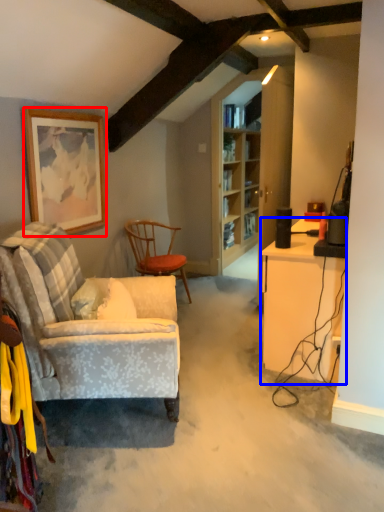
Question: Which object is further to the camera taking this photo, picture frame (highlighted by a red box) or desk (highlighted by a blue box)?

Choices:
 (A) picture frame
 (B) desk

Answer: (A)